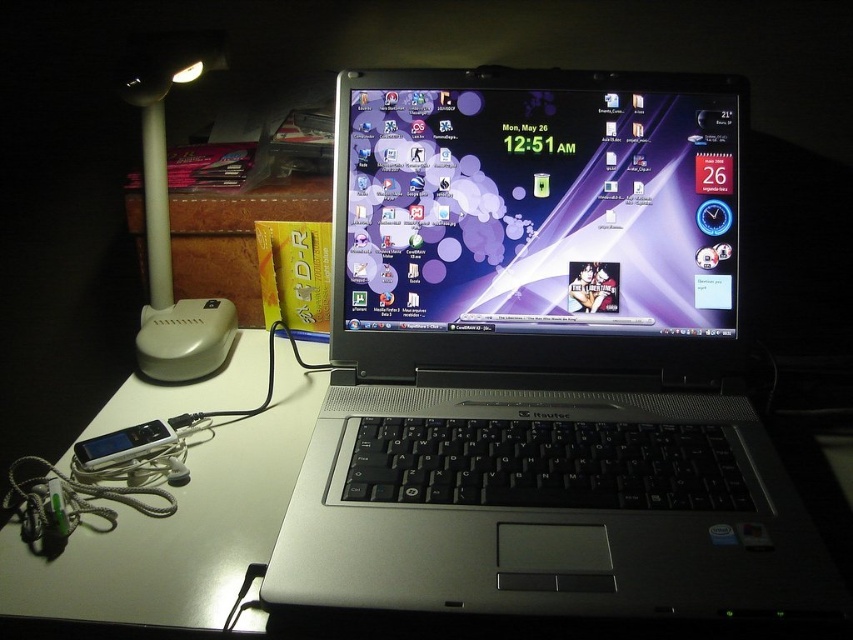
You are organizing your desk and want to place the white plastic table lamp at upper left and the satin silver ipod at lower left in a way that the lamp doesn not block the ipod. Based on their current positions, is this possible?

The white plastic table lamp at upper left is located above the satin silver ipod at lower left, so moving them to their current positions would not block the ipod since the lamp is above it.

You are organizing your desk and want to place a new item between the white glossy table at center and the satin silver ipod at lower left. What is the minimum distance you need to maintain between them to ensure the new item fits?

The minimum distance required is 10.19 centimeters, as the white glossy table at center is currently 10.19 centimeters away from the satin silver ipod at lower left.